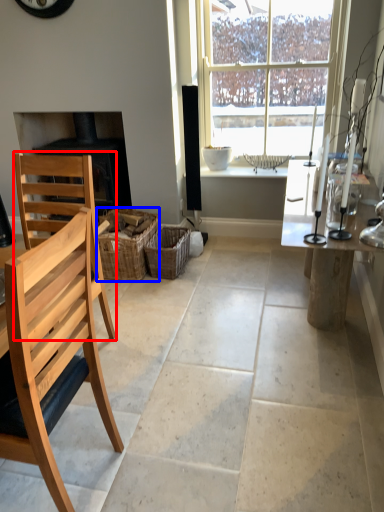
Question: Which point is closer to the camera, chair (highlighted by a red box) or crate (highlighted by a blue box)?

Choices:
 (A) chair
 (B) crate

Answer: (A)